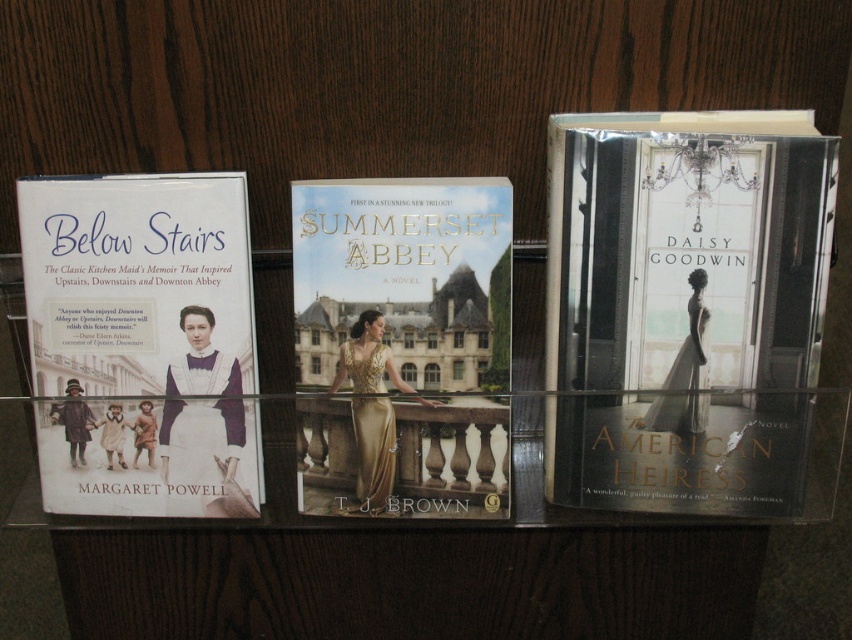
You are organizing a bookshelf and need to place the matte white book at right and the gold fabric book at center. Which book requires more shelf space due to its size?

The matte white book at right requires more shelf space because it is larger in size than the gold fabric book at center.

You are organizing a bookshelf and need to place the matte white book at right and the matte white book at left. According to their positions in the image, which book should you place on the left side of the shelf?

The matte white book at left should be placed on the left side of the shelf because it is positioned to the left of the matte white book at right in the image.

You are standing in front of the glass shelf with the three book covers. You notice two points on the shelf marked as point (819, 326) and point (488, 464). If you were to reach out to touch these points, which one would feel closer to your hand?

Point (819, 326) is closer to the camera than point (488, 464), so touching point (819, 326) would feel closer to your hand.